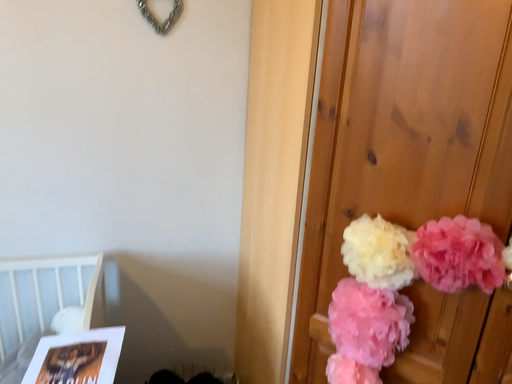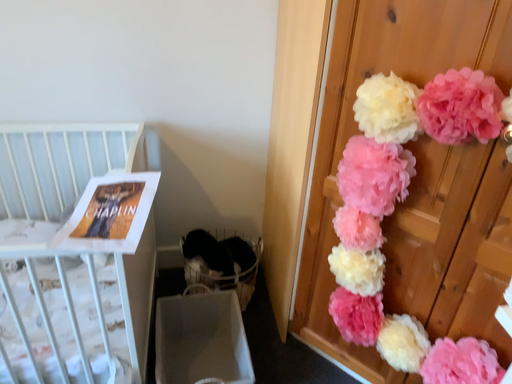
Question: How did the camera likely rotate when shooting the video?

Choices:
 (A) rotated downward
 (B) rotated upward

Answer: (A)